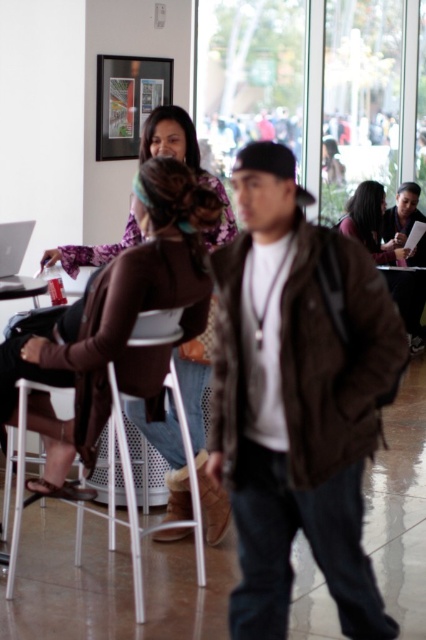
Who is shorter, brown leather jacket at center or matte purple blouse at upper left?

matte purple blouse at upper left is shorter.

Between point (230, 493) and point (190, 410), which one is positioned behind?

The point (190, 410) is more distant.

Who is more forward, (247, 616) or (183, 113)?

Point (247, 616) is in front.

You are a GUI agent. You are given a task and a screenshot of the screen. Output one action in this format:
    pyautogui.click(x=<x>, y=<y>)
    Task: Click on the brown leather jacket at center
    Image resolution: width=426 pixels, height=640 pixels.
    Given the screenshot: What is the action you would take?
    pyautogui.click(x=296, y=401)

Which is above, matte brown jacket at center or matte black laptop at upper center?

Positioned higher is matte black laptop at upper center.

Is matte brown jacket at center to the right of matte black laptop at upper center from the viewer's perspective?

In fact, matte brown jacket at center is to the left of matte black laptop at upper center.

Image resolution: width=426 pixels, height=640 pixels. Describe the element at coordinates (371, 224) in the screenshot. I see `matte brown jacket at center` at that location.

Locate an element on the screen. The image size is (426, 640). matte brown jacket at center is located at coordinates (371, 224).

Who is positioned more to the left, brown leather jacket at center or white plastic chair at lower center?

white plastic chair at lower center is more to the left.

Who is shorter, brown leather jacket at center or white plastic chair at lower center?

white plastic chair at lower center

Is point (256, 493) in front of point (131, 504)?

Yes, point (256, 493) is closer to viewer.

Find the location of a particular element. The image size is (426, 640). brown leather jacket at center is located at coordinates (296, 401).